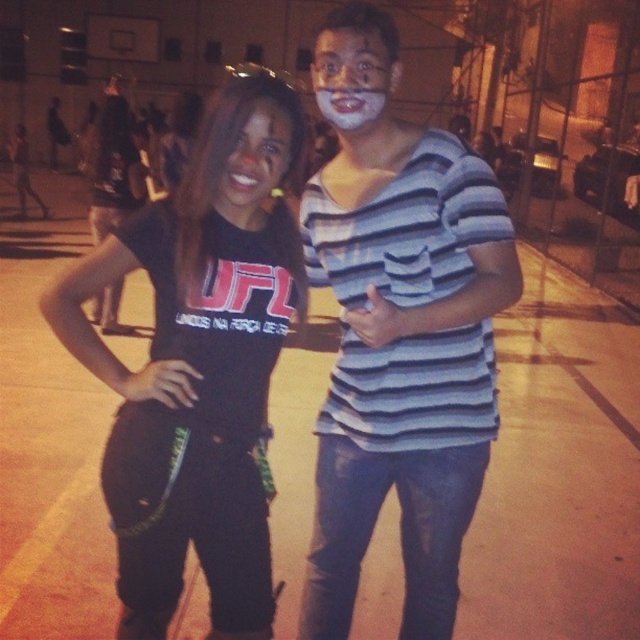
How distant is striped cotton shirt at center from white matte face at center?

striped cotton shirt at center is 72.45 centimeters away from white matte face at center.

Is striped cotton shirt at center further to the viewer compared to white matte face at center?

No, striped cotton shirt at center is in front of white matte face at center.

You are a GUI agent. You are given a task and a screenshot of the screen. Output one action in this format:
    pyautogui.click(x=<x>, y=<y>)
    Task: Click on the striped cotton shirt at center
    This screenshot has width=640, height=640.
    Given the screenshot: What is the action you would take?
    pyautogui.click(x=397, y=332)

Does point (248, 460) come closer to viewer compared to point (259, 141)?

That is False.

Can you confirm if black fabric pants at center is smaller than matte black hair at center?

No, black fabric pants at center is not smaller than matte black hair at center.

You are a GUI agent. You are given a task and a screenshot of the screen. Output one action in this format:
    pyautogui.click(x=<x>, y=<y>)
    Task: Click on the black fabric pants at center
    
    Given the screenshot: What is the action you would take?
    pyautogui.click(x=198, y=364)

Does striped cotton shirt at center have a smaller size compared to black fabric pants at center?

No, striped cotton shirt at center is not smaller than black fabric pants at center.

Looking at this image, is striped cotton shirt at center to the left of black fabric pants at center from the viewer's perspective?

In fact, striped cotton shirt at center is to the right of black fabric pants at center.

Is point (410, 561) farther from viewer compared to point (216, 355)?

Yes.

Locate an element on the screen. The width and height of the screenshot is (640, 640). striped cotton shirt at center is located at coordinates (397, 332).